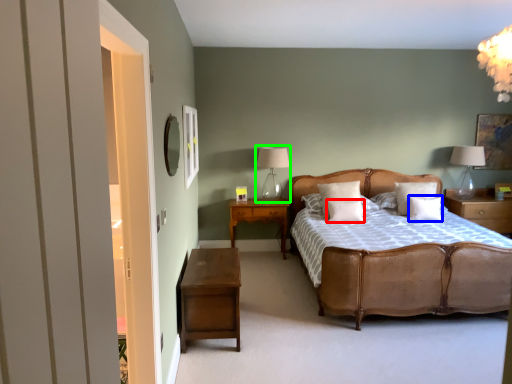
Question: Considering the real-world distances, which object is farthest from pillow (highlighted by a red box)? pillow (highlighted by a blue box) or table lamp (highlighted by a green box)?

Choices:
 (A) pillow
 (B) table lamp

Answer: (B)